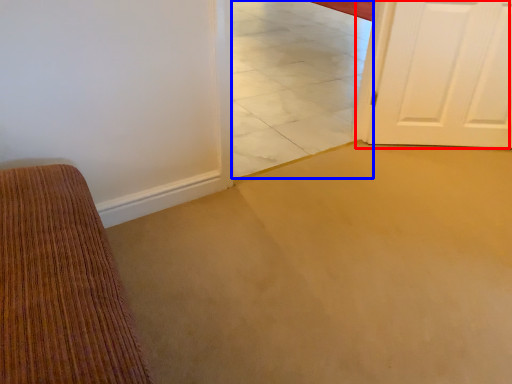
Question: Which object appears farthest to the camera in this image, door (highlighted by a red box) or tile (highlighted by a blue box)?

Choices:
 (A) door
 (B) tile

Answer: (A)